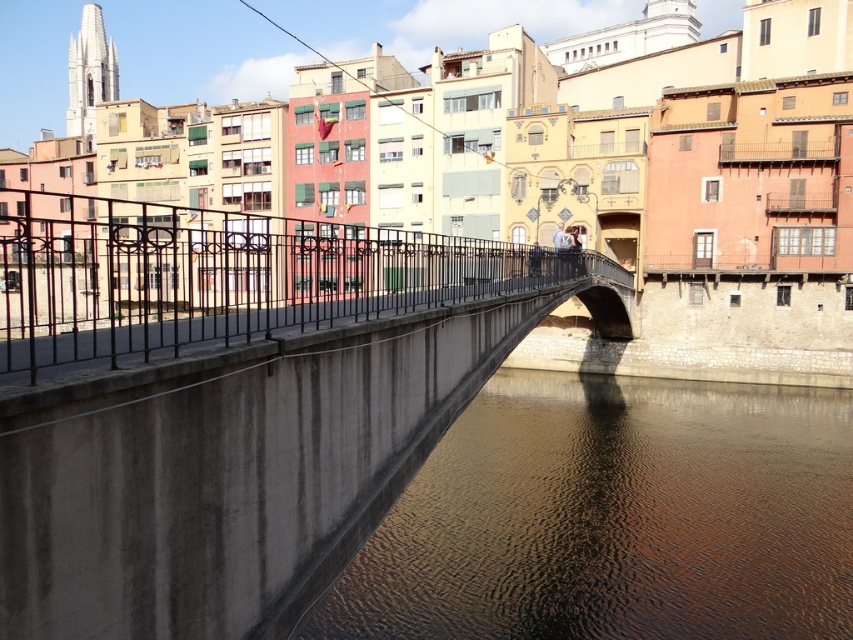
Question: Which point is farther to the camera?

Choices:
 (A) concrete bridge at center
 (B) brown concrete water at lower center
 (C) black wrought iron railing at center

Answer: (B)

Question: Which object is positioned farthest from the brown concrete water at lower center?

Choices:
 (A) concrete bridge at center
 (B) black wrought iron railing at center

Answer: (B)

Question: Which of the following is the farthest from the observer?

Choices:
 (A) (573, 257)
 (B) (457, 604)
 (C) (357, 342)

Answer: (A)

Question: Does concrete bridge at center appear under brown concrete water at lower center?

Choices:
 (A) no
 (B) yes

Answer: (A)

Question: Where is concrete bridge at center located in relation to brown concrete water at lower center in the image?

Choices:
 (A) right
 (B) left

Answer: (B)

Question: Can you confirm if concrete bridge at center is bigger than black wrought iron railing at center?

Choices:
 (A) yes
 (B) no

Answer: (A)